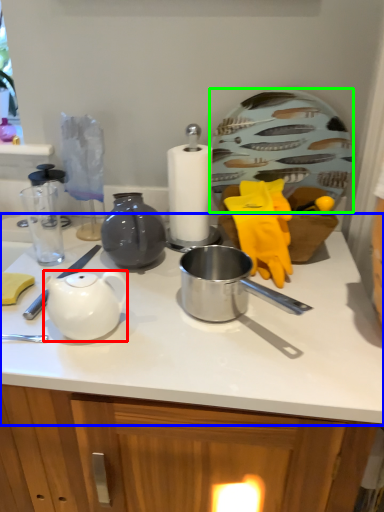
Question: Which object is positioned farthest from teapot (highlighted by a red box)? Select from countertop (highlighted by a blue box) and plate (highlighted by a green box).

Choices:
 (A) countertop
 (B) plate

Answer: (B)